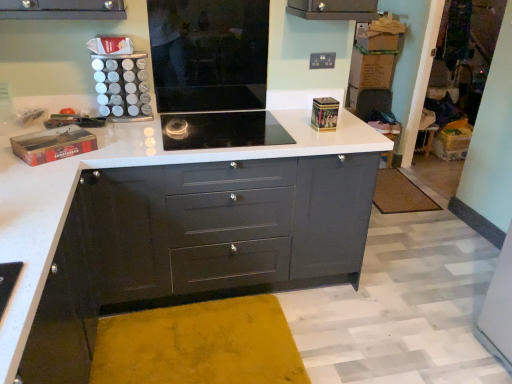
The height and width of the screenshot is (384, 512). What are the coordinates of `free point below brown textured mat at lower right (from a real-world perspective)` in the screenshot? It's located at (397, 190).